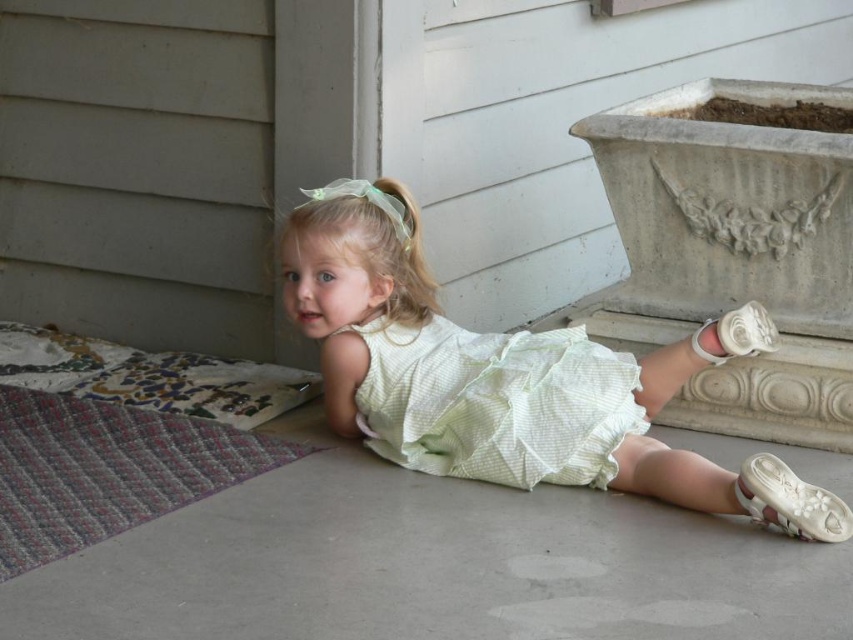
Question: Does light green fabric dress at center have a larger size compared to white fabric sandal at lower right?

Choices:
 (A) yes
 (B) no

Answer: (A)

Question: Which object is farther from the camera taking this photo?

Choices:
 (A) light green fabric dress at center
 (B) white satin shoe at lower right
 (C) white smooth cement at lower center

Answer: (B)

Question: Does light green fabric dress at center appear on the right side of light green textured dress at center?

Choices:
 (A) no
 (B) yes

Answer: (B)

Question: Based on their relative distances, which object is nearer to the white smooth cement at lower center?

Choices:
 (A) light green fabric dress at center
 (B) white fabric sandal at lower right
 (C) light green textured dress at center

Answer: (C)

Question: Is light green fabric dress at center further to camera compared to white satin shoe at lower right?

Choices:
 (A) yes
 (B) no

Answer: (B)

Question: Which object appears farthest from the camera in this image?

Choices:
 (A) white satin shoe at lower right
 (B) white fabric sandal at lower right
 (C) light green fabric dress at center
 (D) light green textured dress at center

Answer: (A)